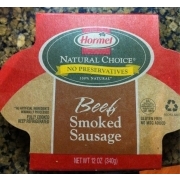
Find the location of a particular element. The width and height of the screenshot is (180, 180). orange toned wood is located at coordinates (169, 171).